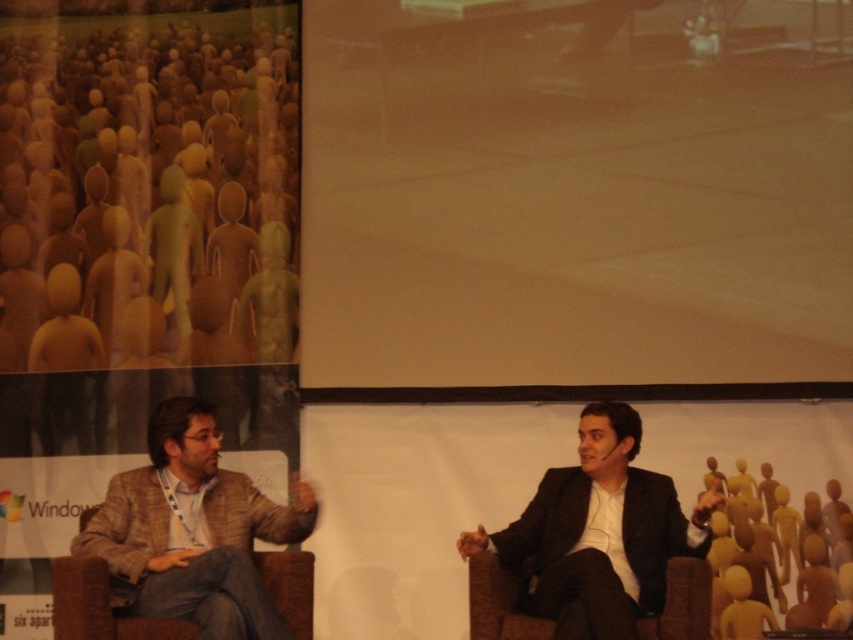
You are an event organizer who needs to ensure proper seating arrangements. Given the plaid wool blazer at left and the brown fabric chair at lower right, which object is positioned higher in the image?

The plaid wool blazer at left is located above the brown fabric chair at lower right, so the plaid wool blazer at left is positioned higher in the image.

Looking at this image, you are an event organizer who needs to place a small microphone stand between the two speakers. The first speaker is wearing the plaid wool blazer at left. The second speaker is wearing a black suit. Based on their positions, where should you place the microphone stand so that it is equidistant from both speakers?

The plaid wool blazer at left is positioned at point (192, 531). To place the microphone stand equidistant between both speakers, calculate the midpoint between their coordinates. However, since only the coordinates of the plaid wool blazer at left are provided, additional information about the black suit speaker is needed to determine the exact placement.